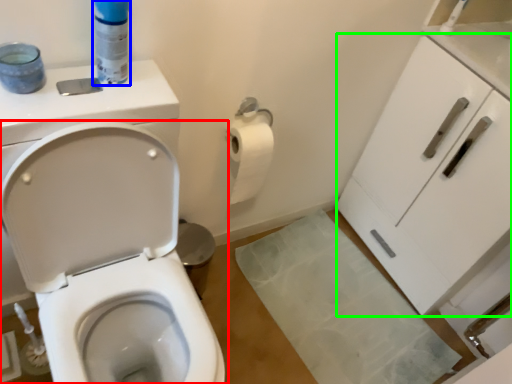
Question: Considering the real-world distances, which object is farthest from toilet (highlighted by a red box)? cleaning product (highlighted by a blue box) or cabinetry (highlighted by a green box)?

Choices:
 (A) cleaning product
 (B) cabinetry

Answer: (B)